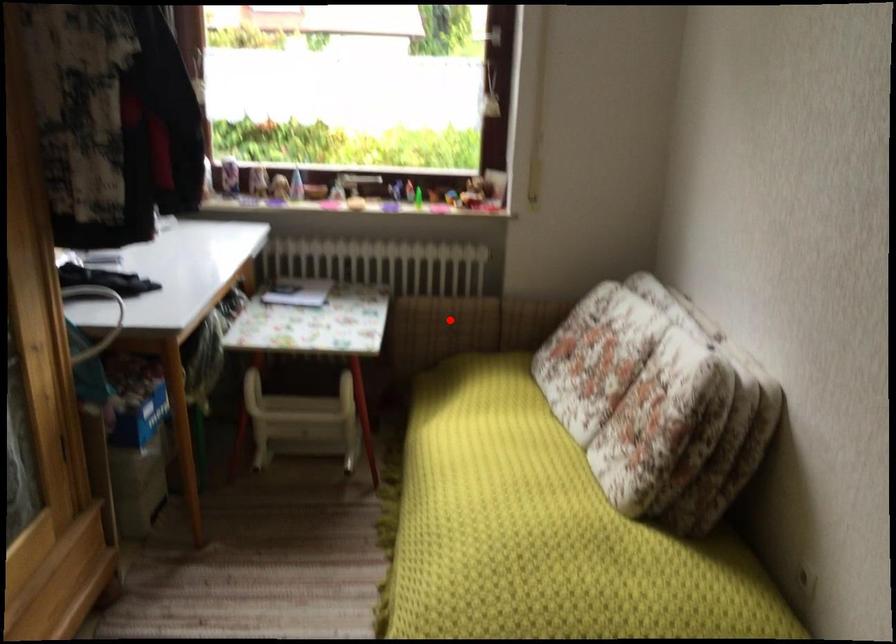
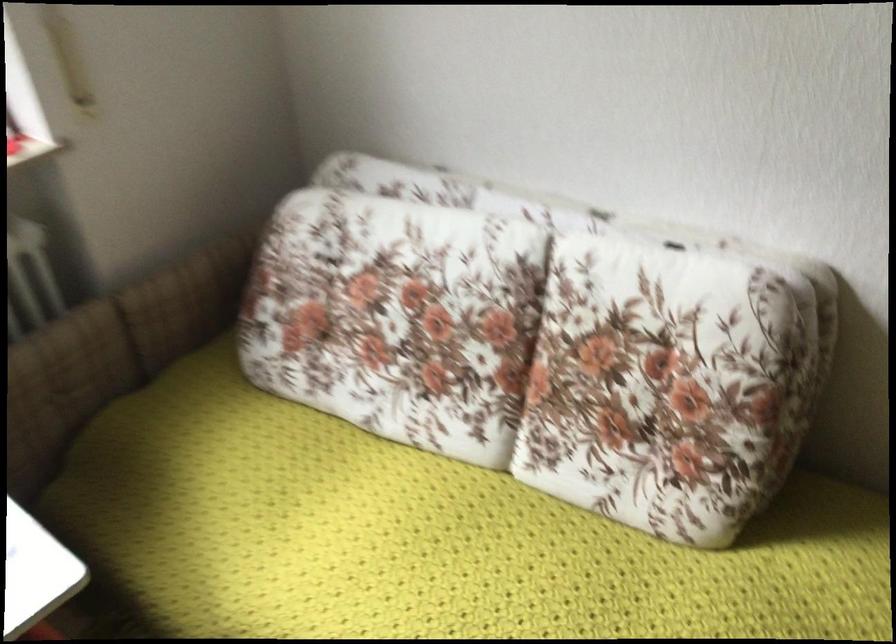
Question: I am providing you with two images of the same scene from different viewpoints. A red point is shown in image1. For the corresponding object point in image2, is it positioned nearer or farther from the camera?

Choices:
 (A) Nearer
 (B) Farther

Answer: (A)